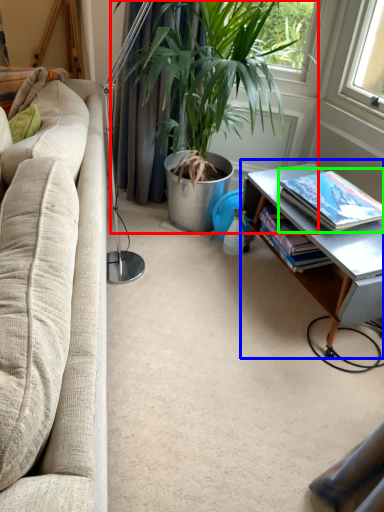
Question: Which object is positioned farthest from houseplant (highlighted by a red box)? Select from table (highlighted by a blue box) and book (highlighted by a green box).

Choices:
 (A) table
 (B) book

Answer: (B)